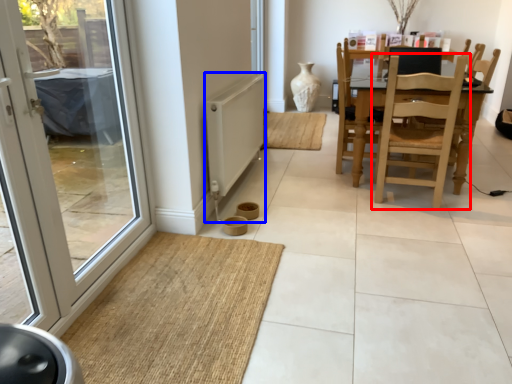
Question: Which object is closer to the camera taking this photo, chair (highlighted by a red box) or radiator (highlighted by a blue box)?

Choices:
 (A) chair
 (B) radiator

Answer: (B)